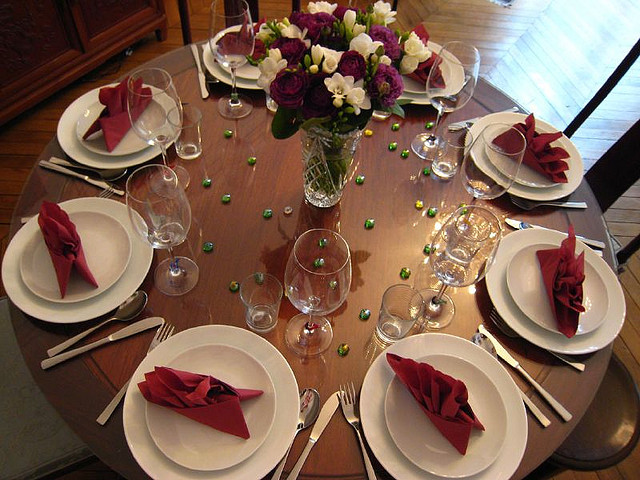
What are the coordinates of `napkins` in the screenshot? It's located at (61, 243), (205, 398), (440, 390), (557, 277), (534, 149), (420, 73), (257, 48), (113, 116).